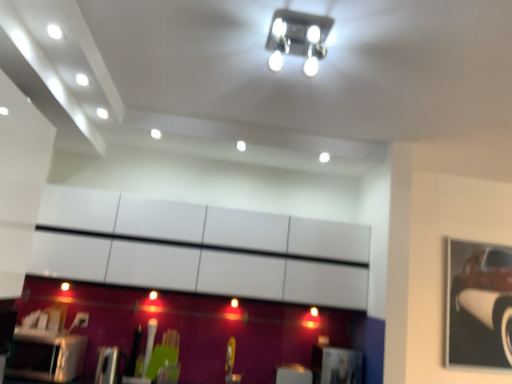
This screenshot has width=512, height=384. I want to click on metallic square light fixture at upper center, so (x=298, y=38).

Is metallic square light fixture at upper center positioned before metallic car at right?

Yes, metallic square light fixture at upper center is closer to the viewer.

Which point is more forward, (x=280, y=9) or (x=505, y=326)?

The point (x=280, y=9) is closer.

How many degrees apart are the facing directions of metallic square light fixture at upper center and metallic car at right?

1.5 degrees separate the facing orientations of metallic square light fixture at upper center and metallic car at right.

Would you say metallic square light fixture at upper center is inside or outside metallic car at right?

metallic square light fixture at upper center is not inside metallic car at right, it's outside.

Is metallic car at right positioned beyond the bounds of metallic square light fixture at upper center?

metallic car at right lies outside metallic square light fixture at upper center's area.

How much distance is there between metallic car at right and metallic square light fixture at upper center?

metallic car at right and metallic square light fixture at upper center are 2.43 meters apart from each other.

Where is `car behind the metallic square light fixture at upper center`? car behind the metallic square light fixture at upper center is located at coordinates (479, 306).

How many degrees apart are the facing directions of metallic car at right and metallic silver toaster at lower left?

0.476 degrees separate the facing orientations of metallic car at right and metallic silver toaster at lower left.

From the image's perspective, is metallic car at right located beneath metallic silver toaster at lower left?

No, from the image's perspective, metallic car at right is not below metallic silver toaster at lower left.

Would you say metallic car at right is to the left or to the right of metallic silver toaster at lower left in the picture?

In the image, metallic car at right appears on the right side of metallic silver toaster at lower left.

From the picture: Could metallic silver toaster at lower left be considered to be inside metallic car at right?

No, metallic silver toaster at lower left is not inside metallic car at right.

What's the angular difference between metallic silver toaster at lower left and metallic car at right's facing directions?

0.476 degrees separate the facing orientations of metallic silver toaster at lower left and metallic car at right.

From a real-world perspective, who is located lower, metallic silver toaster at lower left or metallic car at right?

metallic silver toaster at lower left, from a real-world perspective.

In the scene shown: From the image's perspective, relative to metallic car at right, is metallic silver toaster at lower left above or below?

Based on their image positions, metallic silver toaster at lower left is located beneath metallic car at right.

Which object is positioned more to the right, metallic silver toaster at lower left or metallic car at right?

metallic car at right.

Considering the sizes of metallic silver toaster at lower left and metallic square light fixture at upper center in the image, is metallic silver toaster at lower left bigger or smaller than metallic square light fixture at upper center?

In the image, metallic silver toaster at lower left appears to be larger than metallic square light fixture at upper center.

Would you say metallic silver toaster at lower left is inside or outside metallic square light fixture at upper center?

metallic silver toaster at lower left is not inside metallic square light fixture at upper center, it's outside.

Could you tell me if metallic silver toaster at lower left is turned towards metallic square light fixture at upper center?

No, metallic silver toaster at lower left is not turned towards metallic square light fixture at upper center.

Looking at this image, which is closer, [14,367] or [278,61]?

The point [278,61] is closer to the camera.

Could you tell me if metallic square light fixture at upper center is turned towards metallic silver toaster at lower left?

No, metallic square light fixture at upper center is not oriented towards metallic silver toaster at lower left.

Considering the relative positions of metallic square light fixture at upper center and metallic silver toaster at lower left in the image provided, is metallic square light fixture at upper center to the left or to the right of metallic silver toaster at lower left?

In the image, metallic square light fixture at upper center appears on the right side of metallic silver toaster at lower left.

Based on the photo, from a real-world perspective, which object stands above the other?

metallic square light fixture at upper center is physically above.

What's the angular difference between metallic square light fixture at upper center and metallic silver toaster at lower left's facing directions?

1.97 degrees.

Locate an element on the screen. car on the right side of metallic square light fixture at upper center is located at coordinates 479,306.

You are a GUI agent. You are given a task and a screenshot of the screen. Output one action in this format:
    pyautogui.click(x=<x>, y=<y>)
    Task: Click on the car below the metallic square light fixture at upper center (from a real-world perspective)
    
    Given the screenshot: What is the action you would take?
    pyautogui.click(x=479, y=306)

From the image, which object appears to be farther from metallic car at right, metallic silver toaster at lower left or metallic square light fixture at upper center?

The object further to metallic car at right is metallic silver toaster at lower left.

From the image, which object appears to be nearer to metallic square light fixture at upper center, metallic silver toaster at lower left or metallic car at right?

metallic silver toaster at lower left is positioned closer to the anchor metallic square light fixture at upper center.

Based on their spatial positions, is metallic car at right or metallic silver toaster at lower left further from metallic square light fixture at upper center?

metallic car at right lies further to metallic square light fixture at upper center than the other object.

Considering their positions, is metallic car at right positioned closer to metallic silver toaster at lower left than metallic square light fixture at upper center?

Among the two, metallic square light fixture at upper center is located nearer to metallic silver toaster at lower left.

Based on their spatial positions, is metallic square light fixture at upper center or metallic silver toaster at lower left further from metallic car at right?

metallic silver toaster at lower left is positioned further to the anchor metallic car at right.

Looking at the image, which one is located closer to metallic silver toaster at lower left, metallic square light fixture at upper center or metallic car at right?

metallic square light fixture at upper center.

Where is `light fixture between metallic silver toaster at lower left and metallic car at right in the horizontal direction`? Image resolution: width=512 pixels, height=384 pixels. light fixture between metallic silver toaster at lower left and metallic car at right in the horizontal direction is located at coordinates (298, 38).